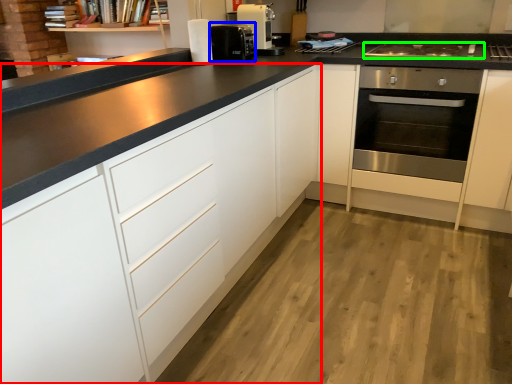
Question: Based on their relative distances, which object is nearer to cabinetry (highlighted by a red box)? Choose from coffee machine (highlighted by a blue box) and gas stove (highlighted by a green box).

Choices:
 (A) coffee machine
 (B) gas stove

Answer: (A)